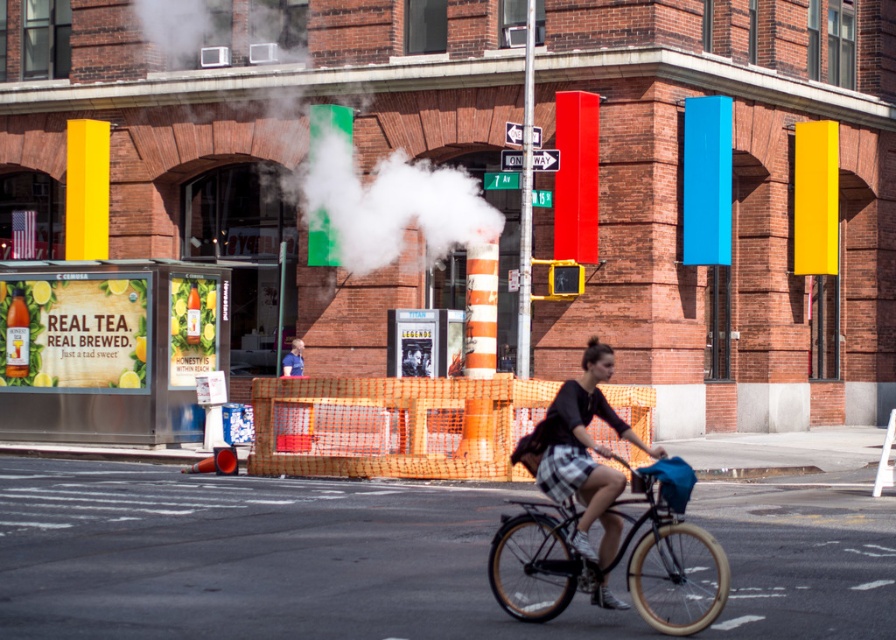
Question: Which object is the farthest from the blue shirt at center?

Choices:
 (A) white vapor at center
 (B) black matte bicycle at center

Answer: (B)

Question: Which point is farther to the camera?

Choices:
 (A) (550, 561)
 (B) (296, 358)

Answer: (B)

Question: Is matte black shirt at center behind blue shirt at center?

Choices:
 (A) no
 (B) yes

Answer: (A)

Question: Is white vapor at center to the right of matte black shirt at center from the viewer's perspective?

Choices:
 (A) yes
 (B) no

Answer: (B)

Question: Is white vapor at center to the right of black matte bicycle at center from the viewer's perspective?

Choices:
 (A) yes
 (B) no

Answer: (B)

Question: Estimate the real-world distances between objects in this image. Which object is closer to the black matte bicycle at center?

Choices:
 (A) blue shirt at center
 (B) white vapor at center
 (C) matte black shirt at center

Answer: (C)